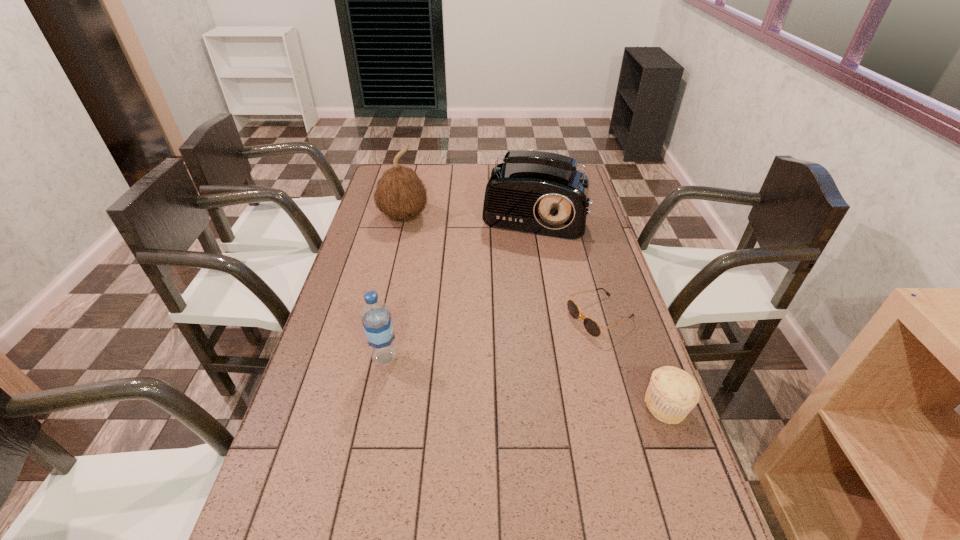
I want to click on vacant position located 0.210m on the front-facing side of the radio receiver, so click(512, 277).

The width and height of the screenshot is (960, 540). What are the coordinates of `free region located 0.140m on the front-facing side of the radio receiver` in the screenshot? It's located at (516, 264).

Identify the location of free space located 0.220m on the front-facing side of the radio receiver. The height and width of the screenshot is (540, 960). (511, 279).

What are the coordinates of `vacant point located 0.250m on the lenses of the shortest object` in the screenshot? It's located at (502, 363).

The height and width of the screenshot is (540, 960). In order to click on vacant area situated 0.100m on the lenses of the shortest object in this screenshot , I will do `click(547, 342)`.

I want to click on vacant position located 0.180m on the lenses of the shortest object, so click(523, 353).

I want to click on free space located on the surface of the coconut, so click(x=463, y=287).

You are a GUI agent. You are given a task and a screenshot of the screen. Output one action in this format:
    pyautogui.click(x=<x>, y=<y>)
    Task: Click on the vacant space located 0.120m on the surface of the coconut
    Image resolution: width=960 pixels, height=540 pixels.
    Given the screenshot: What is the action you would take?
    pyautogui.click(x=429, y=247)

The width and height of the screenshot is (960, 540). In order to click on free space located 0.070m on the surface of the coconut in this screenshot , I will do `click(423, 240)`.

Where is `object that is at the far edge`? The image size is (960, 540). object that is at the far edge is located at coordinates (536, 192).